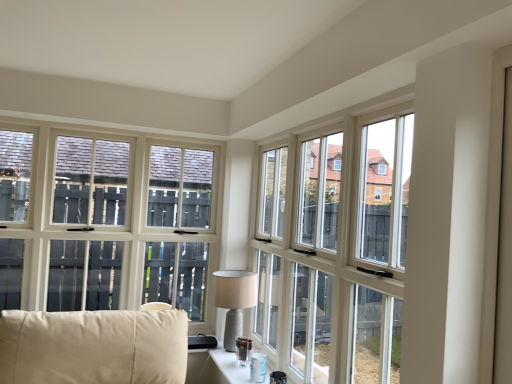
Where is `clear glass table at lower center`? This screenshot has width=512, height=384. clear glass table at lower center is located at coordinates (230, 366).

Find the location of `transparent glass window at center`. transparent glass window at center is located at coordinates (335, 249).

Locate an element on the screen. clear glass table at lower center is located at coordinates (230, 366).

Does point (268, 367) appear closer or farther from the camera than point (351, 257)?

Point (268, 367) is positioned farther from the camera compared to point (351, 257).

Considering their positions, is clear glass table at lower center located in front of or behind transparent glass window at center?

In the image, clear glass table at lower center appears behind transparent glass window at center.

Looking at their sizes, would you say clear glass table at lower center is wider or thinner than transparent glass window at center?

clear glass table at lower center is wider than transparent glass window at center.

Is clear glass table at lower center taller or shorter than transparent glass window at center?

Considering their sizes, clear glass table at lower center has less height than transparent glass window at center.

Is transparent glass window at center in contact with matte gray lamp at center?

No, transparent glass window at center is not with matte gray lamp at center.

Is transparent glass window at center positioned beyond the bounds of matte gray lamp at center?

Yes.

Considering the sizes of transparent glass window at center and matte gray lamp at center in the image, is transparent glass window at center bigger or smaller than matte gray lamp at center?

Clearly, transparent glass window at center is larger in size than matte gray lamp at center.

Which is in front, transparent glass window at center or clear glass table at lower center?

transparent glass window at center.

Can you see transparent glass window at center touching clear glass table at lower center?

transparent glass window at center is not next to clear glass table at lower center, and they're not touching.

How many degrees apart are the facing directions of transparent glass window at center and clear glass table at lower center?

The angle between the facing direction of transparent glass window at center and the facing direction of clear glass table at lower center is 0.439 degrees.

Consider the image. From the image's perspective, would you say transparent glass window at center is shown under clear glass table at lower center?

No, from the image's perspective, transparent glass window at center is not below clear glass table at lower center.

Choose the correct answer: Is matte gray lamp at center inside clear glass table at lower center or outside it?

matte gray lamp at center is spatially situated outside clear glass table at lower center.

Which of these two, matte gray lamp at center or clear glass table at lower center, is smaller?

clear glass table at lower center is smaller.

The image size is (512, 384). What are the coordinates of `table located below the matte gray lamp at center (from the image's perspective)` in the screenshot? It's located at (230, 366).

From a real-world perspective, who is located lower, matte gray lamp at center or clear glass table at lower center?

From a 3D spatial view, clear glass table at lower center is below.

From the image's perspective, is clear glass table at lower center on top of matte gray lamp at center?

No, from the image's perspective, clear glass table at lower center is not above matte gray lamp at center.

Considering the relative positions of clear glass table at lower center and matte gray lamp at center in the image provided, is clear glass table at lower center to the left or to the right of matte gray lamp at center?

clear glass table at lower center is positioned on matte gray lamp at center's right side.

Would you say matte gray lamp at center is part of clear glass table at lower center's contents?

No, clear glass table at lower center does not contain matte gray lamp at center.

Does clear glass table at lower center touch matte gray lamp at center?

No, clear glass table at lower center is not touching matte gray lamp at center.

Looking at this image, from a real-world perspective, is matte gray lamp at center positioned over transparent glass window at center based on gravity?

No, from a real-world perspective, matte gray lamp at center is not over transparent glass window at center

From the image's perspective, between matte gray lamp at center and transparent glass window at center, who is located below?

matte gray lamp at center appears lower in the image.

In the scene shown: Which is nearer, [228,307] or [305,191]?

Point [228,307].

Is transparent glass window at center at the back of matte gray lamp at center?

No, matte gray lamp at center's orientation is not away from transparent glass window at center.

Locate an element on the screen. The width and height of the screenshot is (512, 384). table located underneath the transparent glass window at center (from a real-world perspective) is located at coordinates (230, 366).

Identify the location of table lamp that is behind the transparent glass window at center. (234, 300).

Looking at the image, which one is located closer to clear glass table at lower center, matte gray lamp at center or transparent glass window at center?

Based on the image, matte gray lamp at center appears to be nearer to clear glass table at lower center.

Which object lies nearer to the anchor point transparent glass window at center, matte gray lamp at center or clear glass table at lower center?

The object closer to transparent glass window at center is matte gray lamp at center.

From the image, which object appears to be nearer to clear glass table at lower center, transparent glass window at center or matte gray lamp at center?

matte gray lamp at center.

Looking at this image, based on their spatial positions, is clear glass table at lower center or transparent glass window at center further from matte gray lamp at center?

Based on the image, transparent glass window at center appears to be further to matte gray lamp at center.

Considering their positions, is transparent glass window at center positioned further to matte gray lamp at center than clear glass table at lower center?

Among the two, transparent glass window at center is located further to matte gray lamp at center.

Considering their positions, is clear glass table at lower center positioned closer to transparent glass window at center than matte gray lamp at center?

matte gray lamp at center is positioned closer to the anchor transparent glass window at center.

Locate an element on the screen. This screenshot has width=512, height=384. table between transparent glass window at center and matte gray lamp at center in the front-back direction is located at coordinates (230, 366).